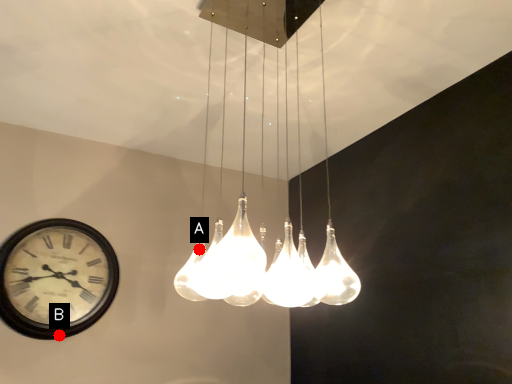
Question: Two points are circled on the image, labeled by A and B beside each circle. Which point appears farthest from the camera in this image?

Choices:
 (A) A is further
 (B) B is further

Answer: (B)